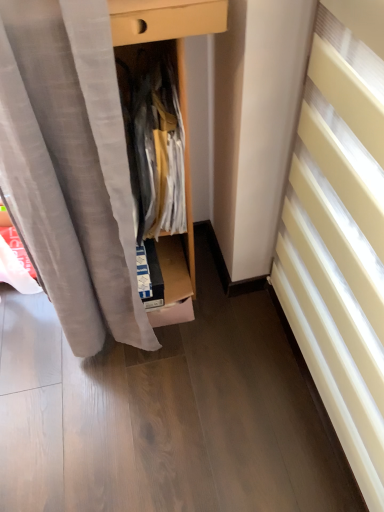
The image size is (384, 512). I want to click on white textured radiator at right, so click(x=340, y=244).

This screenshot has height=512, width=384. What do you see at coordinates (340, 244) in the screenshot? I see `white textured radiator at right` at bounding box center [340, 244].

Measure the distance between white cotton shirt at center and camera.

35.53 inches.

This screenshot has height=512, width=384. What do you see at coordinates (155, 152) in the screenshot?
I see `white cotton shirt at center` at bounding box center [155, 152].

Measure the distance between point (x=150, y=152) and camera.

A distance of 3.32 feet exists between point (x=150, y=152) and camera.

You are a GUI agent. You are given a task and a screenshot of the screen. Output one action in this format:
    pyautogui.click(x=<x>, y=<y>)
    Task: Click on the white cotton shirt at center
    The height and width of the screenshot is (512, 384).
    Given the screenshot: What is the action you would take?
    pyautogui.click(x=155, y=152)

The height and width of the screenshot is (512, 384). In order to click on white textured radiator at right in this screenshot , I will do `click(340, 244)`.

Which is more to the right, white cotton shirt at center or white textured radiator at right?

Positioned to the right is white textured radiator at right.

Is white cotton shirt at center closer to the viewer compared to white textured radiator at right?

No, white cotton shirt at center is further to the viewer.

Which point is more distant from viewer, [171,125] or [306,258]?

The point [306,258] is behind.

From the image's perspective, which is below, white cotton shirt at center or white textured radiator at right?

From the image's view, white textured radiator at right is below.

From a real-world perspective, who is located higher, white cotton shirt at center or white textured radiator at right?

white cotton shirt at center, from a real-world perspective.

Considering the sizes of white cotton shirt at center and white textured radiator at right in the image, is white cotton shirt at center wider or thinner than white textured radiator at right?

Clearly, white cotton shirt at center has less width compared to white textured radiator at right.

Between white cotton shirt at center and white textured radiator at right, which one has less height?

Standing shorter between the two is white cotton shirt at center.

Does white cotton shirt at center have a smaller size compared to white textured radiator at right?

Indeed, white cotton shirt at center has a smaller size compared to white textured radiator at right.

Is white cotton shirt at center inside or outside of white textured radiator at right?

white cotton shirt at center cannot be found inside white textured radiator at right.

Is white cotton shirt at center touching white textured radiator at right?

There is a gap between white cotton shirt at center and white textured radiator at right.

Is white cotton shirt at center oriented away from white textured radiator at right?

No, white cotton shirt at center's orientation is not away from white textured radiator at right.

Can you tell me how much white cotton shirt at center and white textured radiator at right differ in facing direction?

They differ by 5.27 degrees in their facing directions.

I want to click on clothing that is on the left side of white textured radiator at right, so click(155, 152).

Visually, is white textured radiator at right positioned to the left or to the right of white cotton shirt at center?

In the image, white textured radiator at right appears on the right side of white cotton shirt at center.

Based on the photo, which object is closer to the camera taking this photo, white textured radiator at right or white cotton shirt at center?

white textured radiator at right.

Considering the points (324, 315) and (137, 121), which point is behind, point (324, 315) or point (137, 121)?

The point (137, 121) is more distant.

From the image's perspective, is white textured radiator at right located above or below white cotton shirt at center?

Clearly, from the image's perspective, white textured radiator at right is below white cotton shirt at center.

From a real-world perspective, is white textured radiator at right under white cotton shirt at center?

Yes, from a real-world perspective, white textured radiator at right is beneath white cotton shirt at center.

Which object is thinner, white textured radiator at right or white cotton shirt at center?

Thinner between the two is white cotton shirt at center.

Who is shorter, white textured radiator at right or white cotton shirt at center?

white cotton shirt at center is shorter.

Who is bigger, white textured radiator at right or white cotton shirt at center?

With larger size is white textured radiator at right.

Is white textured radiator at right inside the boundaries of white cotton shirt at center, or outside?

white textured radiator at right is not enclosed by white cotton shirt at center.

Are white textured radiator at right and white cotton shirt at center located far from each other?

No, there isn't a large distance between white textured radiator at right and white cotton shirt at center.

Is white textured radiator at right oriented away from white cotton shirt at center?

white textured radiator at right is not turned away from white cotton shirt at center.

How many degrees apart are the facing directions of white textured radiator at right and white cotton shirt at center?

The facing directions of white textured radiator at right and white cotton shirt at center are 5.27 degrees apart.

At what (x,y) coordinates should I click in order to perform the action: click on stairwell below the white cotton shirt at center (from a real-world perspective). Please return your answer as a coordinate pair (x, y). Looking at the image, I should click on (340, 244).

Locate an element on the screen. This screenshot has height=512, width=384. stairwell on the right side of white cotton shirt at center is located at coordinates (340, 244).

You are a GUI agent. You are given a task and a screenshot of the screen. Output one action in this format:
    pyautogui.click(x=<x>, y=<y>)
    Task: Click on the clothing above the white textured radiator at right (from the image's perspective)
    This screenshot has width=384, height=512.
    Given the screenshot: What is the action you would take?
    pyautogui.click(x=155, y=152)